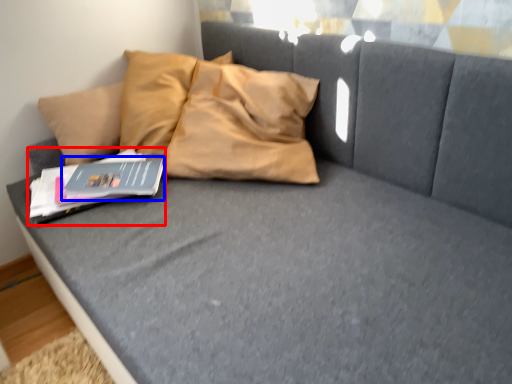
Question: Which object is further to the camera taking this photo, paperback book (highlighted by a red box) or paperback book (highlighted by a blue box)?

Choices:
 (A) paperback book
 (B) paperback book

Answer: (B)